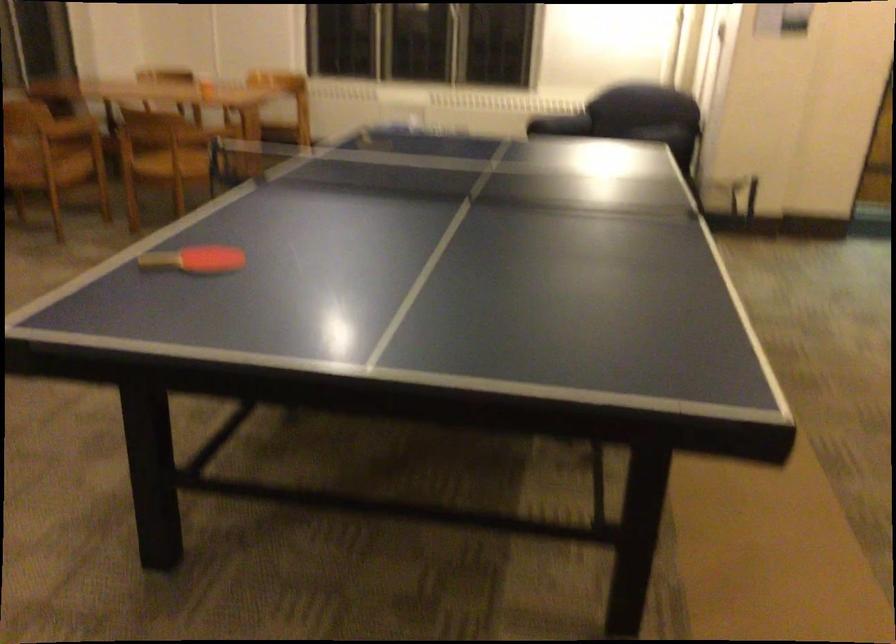
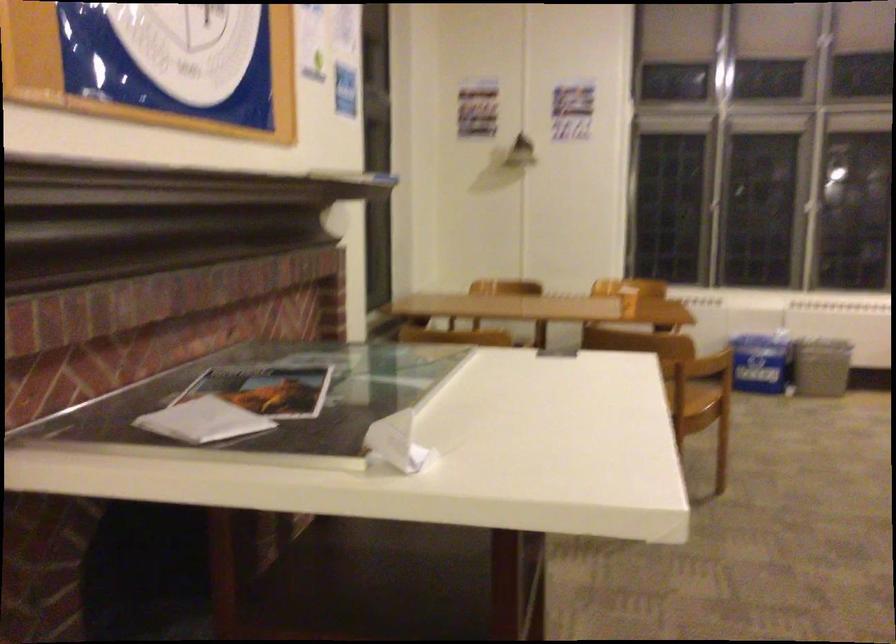
Consider the image. In a continuous first-person perspective shot, in which direction is the camera moving?

The movement direction of the cameraman is left, forward.